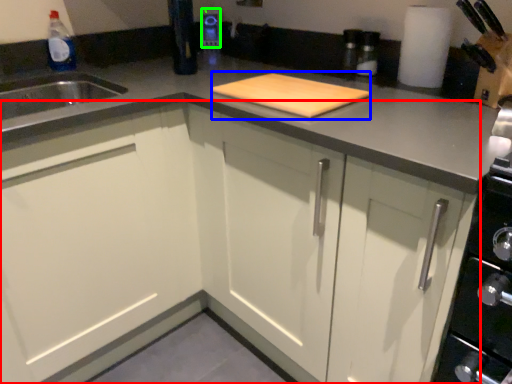
Question: Estimate the real-world distances between objects in this image. Which object is farther from cabinetry (highlighted by a red box), cutting board (highlighted by a blue box) or appliance (highlighted by a green box)?

Choices:
 (A) cutting board
 (B) appliance

Answer: (B)